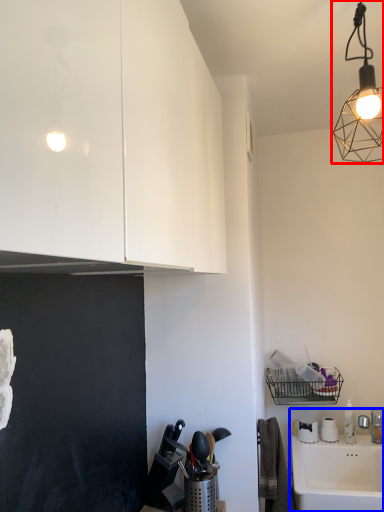
Question: Which point is further to the camera, lamp (highlighted by a red box) or sink (highlighted by a blue box)?

Choices:
 (A) lamp
 (B) sink

Answer: (B)